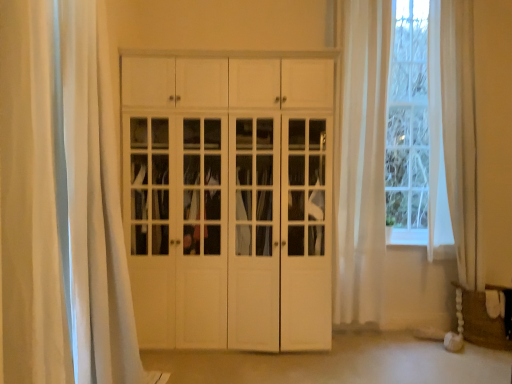
Question: Is the depth of brown woven basket at lower right greater than that of sheer white curtain at right, the second curtain when ordered from left to right?

Choices:
 (A) yes
 (B) no

Answer: (B)

Question: Is brown woven basket at lower right aimed at sheer white curtain at right, which ranks as the first curtain in right-to-left order?

Choices:
 (A) no
 (B) yes

Answer: (A)

Question: Considering the relative sizes of brown woven basket at lower right and sheer white curtain at right, the second curtain when ordered from left to right, in the image provided, is brown woven basket at lower right taller than sheer white curtain at right, the second curtain when ordered from left to right,?

Choices:
 (A) no
 (B) yes

Answer: (A)

Question: Is brown woven basket at lower right at the left side of sheer white curtain at right, which appears as the first curtain when viewed from the back?

Choices:
 (A) yes
 (B) no

Answer: (B)

Question: Considering the relative sizes of brown woven basket at lower right and sheer white curtain at right, which ranks as the second curtain in front-to-back order, in the image provided, is brown woven basket at lower right thinner than sheer white curtain at right, which ranks as the second curtain in front-to-back order,?

Choices:
 (A) no
 (B) yes

Answer: (A)

Question: From the image's perspective, is brown woven basket at lower right under sheer white curtain at right, the second curtain when ordered from left to right?

Choices:
 (A) yes
 (B) no

Answer: (A)

Question: Does brown woven basket at lower right have a smaller size compared to white matte cabinet at center?

Choices:
 (A) no
 (B) yes

Answer: (B)

Question: Does brown woven basket at lower right have a lesser width compared to white matte cabinet at center?

Choices:
 (A) no
 (B) yes

Answer: (B)

Question: Does brown woven basket at lower right have a lesser height compared to white matte cabinet at center?

Choices:
 (A) yes
 (B) no

Answer: (A)

Question: Would you say brown woven basket at lower right is a long distance from white matte cabinet at center?

Choices:
 (A) yes
 (B) no

Answer: (A)

Question: Is brown woven basket at lower right at the left side of white matte cabinet at center?

Choices:
 (A) yes
 (B) no

Answer: (B)

Question: Does brown woven basket at lower right come behind white matte cabinet at center?

Choices:
 (A) yes
 (B) no

Answer: (A)

Question: Considering the relative sizes of white sheer curtain at left, the 1th curtain positioned from the left, and white matte cabinet at center in the image provided, is white sheer curtain at left, the 1th curtain positioned from the left, shorter than white matte cabinet at center?

Choices:
 (A) yes
 (B) no

Answer: (A)